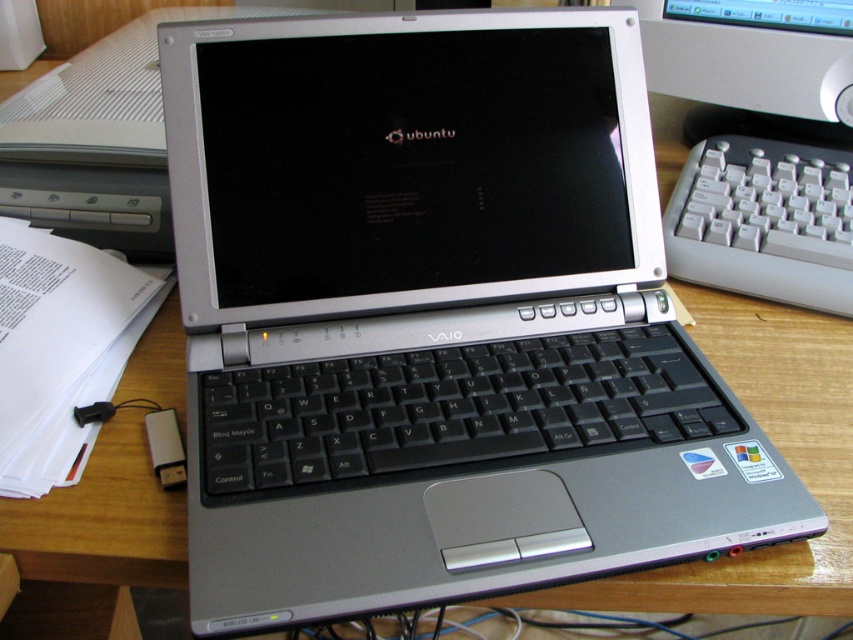
You are setting up a computer desk and need to place the gray plastic keyboard at right and the matte black monitor at upper center. According to the image, which object is located to the left of the other?

The gray plastic keyboard at right is positioned on the left side of matte black monitor at upper center.

You are setting up a computer desk and need to connect a keyboard and monitor. Based on the scene, where should you place the gray plastic keyboard at right relative to the matte black monitor at upper center?

The gray plastic keyboard at right should be placed below the matte black monitor at upper center to align with their positions in the scene.